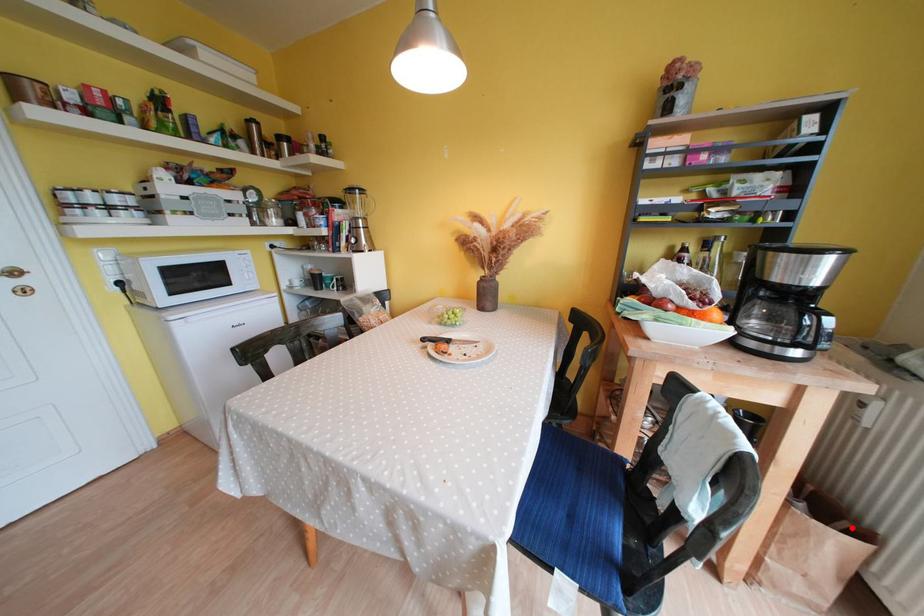
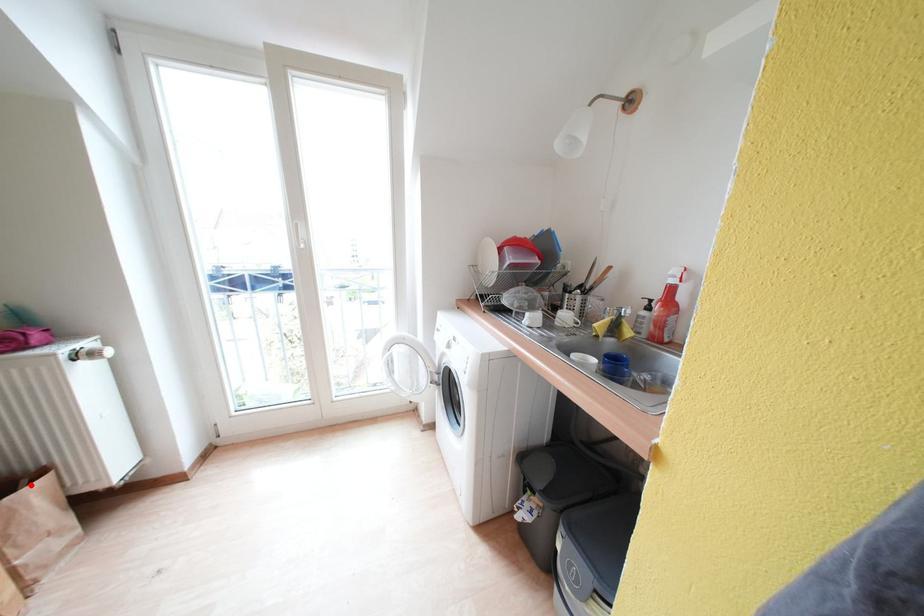
I am providing you with two images of the same scene from different viewpoints. A red point is marked on the first image and another point is marked on the second image. Is the red point in image1 aligned with the point shown in image2?

Yes